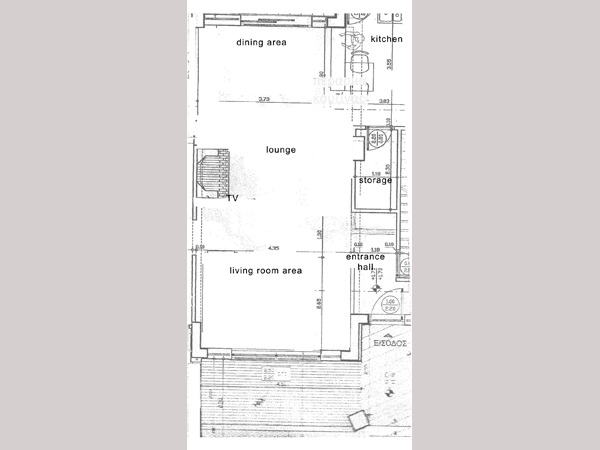
You are a GUI agent. You are given a task and a screenshot of the screen. Output one action in this format:
    pyautogui.click(x=<x>, y=<y>)
    Task: Click on the room
    This screenshot has height=450, width=600.
    Given the screenshot: What is the action you would take?
    pyautogui.click(x=269, y=269)